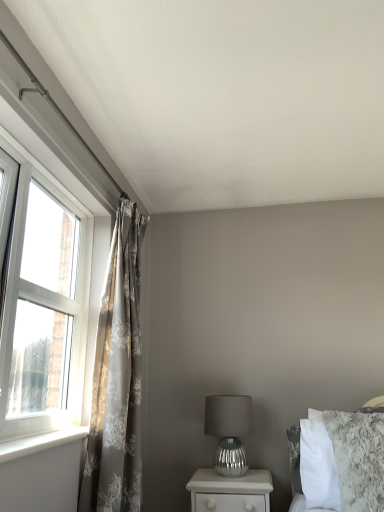
Question: From a real-world perspective, does silver metallic table lamp at center stand above white plastic window at left?

Choices:
 (A) no
 (B) yes

Answer: (A)

Question: From a real-world perspective, does silver metallic table lamp at center sit lower than white plastic window at left?

Choices:
 (A) no
 (B) yes

Answer: (B)

Question: Is silver metallic table lamp at center completely or partially outside of white plastic window at left?

Choices:
 (A) yes
 (B) no

Answer: (A)

Question: Considering the relative sizes of silver metallic table lamp at center and white plastic window at left in the image provided, is silver metallic table lamp at center taller than white plastic window at left?

Choices:
 (A) no
 (B) yes

Answer: (A)

Question: Is silver metallic table lamp at center shorter than white plastic window at left?

Choices:
 (A) yes
 (B) no

Answer: (A)

Question: Does silver metallic table lamp at center have a larger size compared to white plastic window at left?

Choices:
 (A) no
 (B) yes

Answer: (A)

Question: From a real-world perspective, is silver metallic nightstand at lower center physically below silky gray curtains at left?

Choices:
 (A) no
 (B) yes

Answer: (B)

Question: Considering the relative sizes of silver metallic nightstand at lower center and silky gray curtains at left in the image provided, is silver metallic nightstand at lower center shorter than silky gray curtains at left?

Choices:
 (A) yes
 (B) no

Answer: (A)

Question: Does silver metallic nightstand at lower center have a greater width compared to silky gray curtains at left?

Choices:
 (A) yes
 (B) no

Answer: (A)

Question: Is silver metallic nightstand at lower center behind silky gray curtains at left?

Choices:
 (A) yes
 (B) no

Answer: (A)

Question: From the image's perspective, is silver metallic nightstand at lower center under silky gray curtains at left?

Choices:
 (A) yes
 (B) no

Answer: (A)

Question: Is silver metallic nightstand at lower center aimed at silky gray curtains at left?

Choices:
 (A) no
 (B) yes

Answer: (A)

Question: Can you confirm if white fluffy bed at upper right is positioned to the right of white plastic window at left?

Choices:
 (A) yes
 (B) no

Answer: (A)